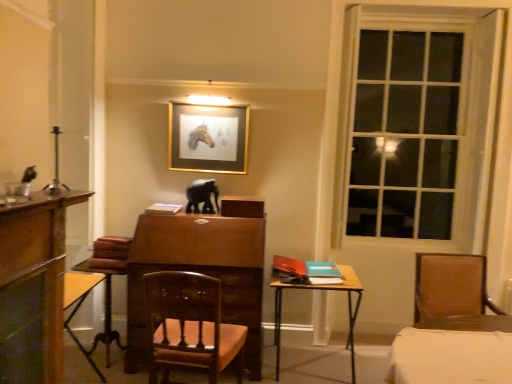
Identify the location of free location above gold metallic picture frame at upper center (from a real-world perspective). The image size is (512, 384). (208, 102).